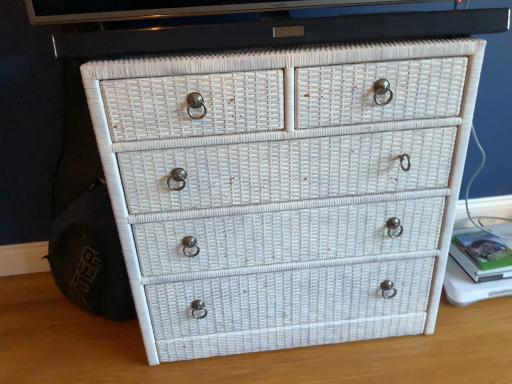
Question: From the image's perspective, relative to green matte book at right, is white wicker chest of drawers at center above or below?

Choices:
 (A) below
 (B) above

Answer: (B)

Question: Is white wicker chest of drawers at center in front of or behind green matte book at right in the image?

Choices:
 (A) behind
 (B) front

Answer: (B)

Question: Considering the real-world distances, which object is closest to the white wicker drawer at center?

Choices:
 (A) green matte book at right
 (B) white wicker chest of drawers at center

Answer: (B)

Question: Which is farther from the white wicker chest of drawers at center?

Choices:
 (A) green matte book at right
 (B) white wicker drawer at center

Answer: (A)